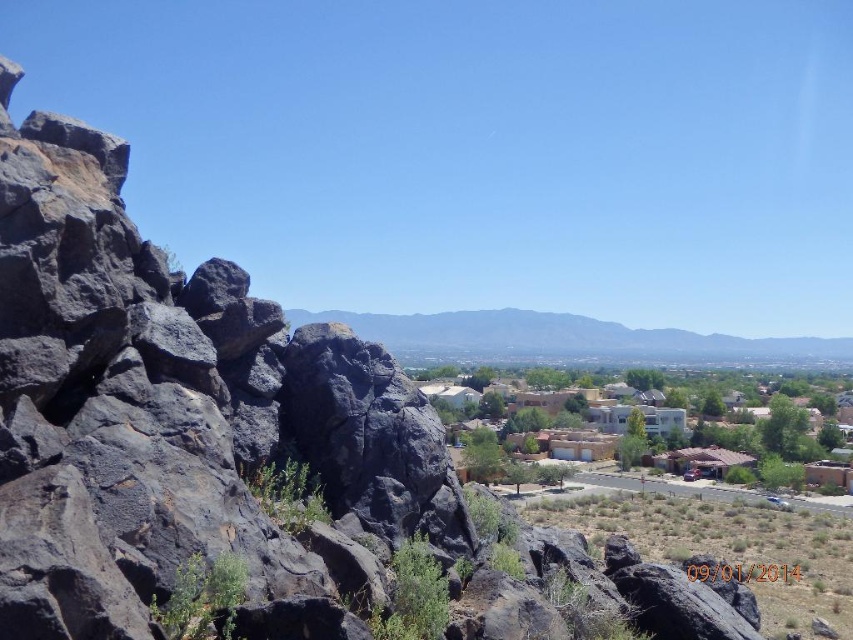
Question: Which point is closer to the camera taking this photo?

Choices:
 (A) (648, 346)
 (B) (602, 413)

Answer: (B)

Question: Which of the following is the farthest from the observer?

Choices:
 (A) adobe houses at center
 (B) gray rock formation at center

Answer: (A)

Question: Which object appears farthest from the camera in this image?

Choices:
 (A) gray rock formation at center
 (B) adobe houses at center

Answer: (B)

Question: Does adobe houses at center have a larger size compared to gray rock formation at center?

Choices:
 (A) no
 (B) yes

Answer: (A)

Question: Does adobe houses at center appear under gray rock formation at center?

Choices:
 (A) yes
 (B) no

Answer: (A)

Question: Is adobe houses at center to the right of gray rock formation at center from the viewer's perspective?

Choices:
 (A) yes
 (B) no

Answer: (B)